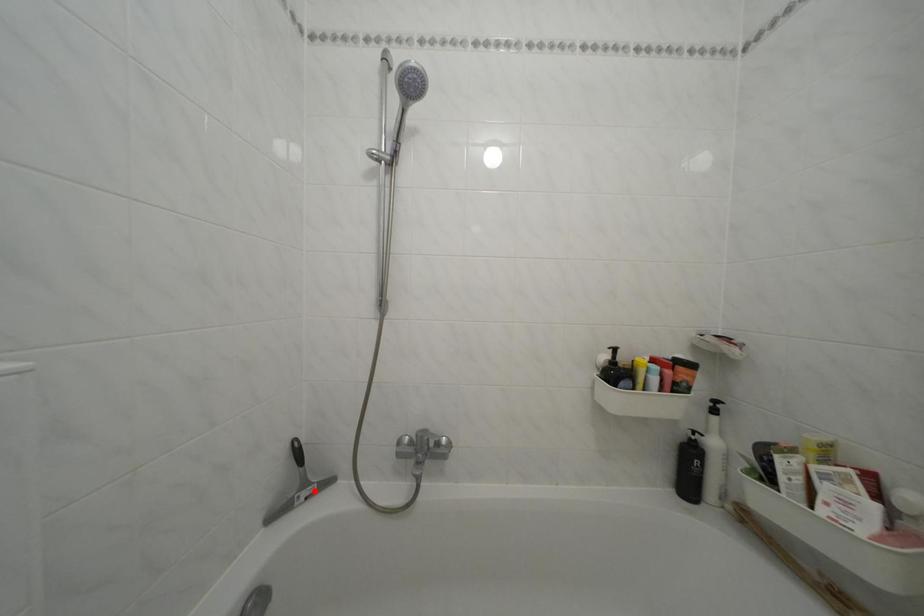
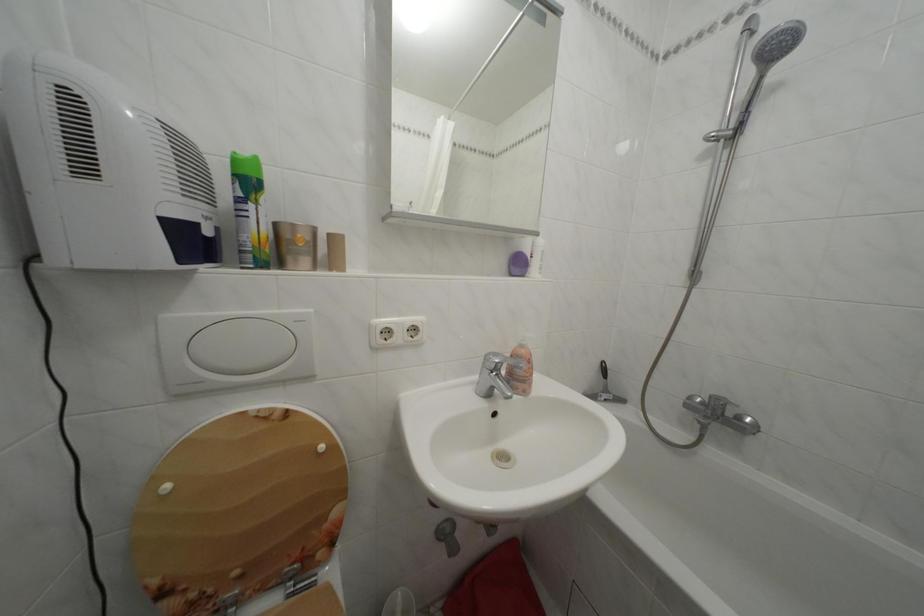
The point at the highlighted location is marked in the first image. Where is the corresponding point in the second image?

(614, 397)